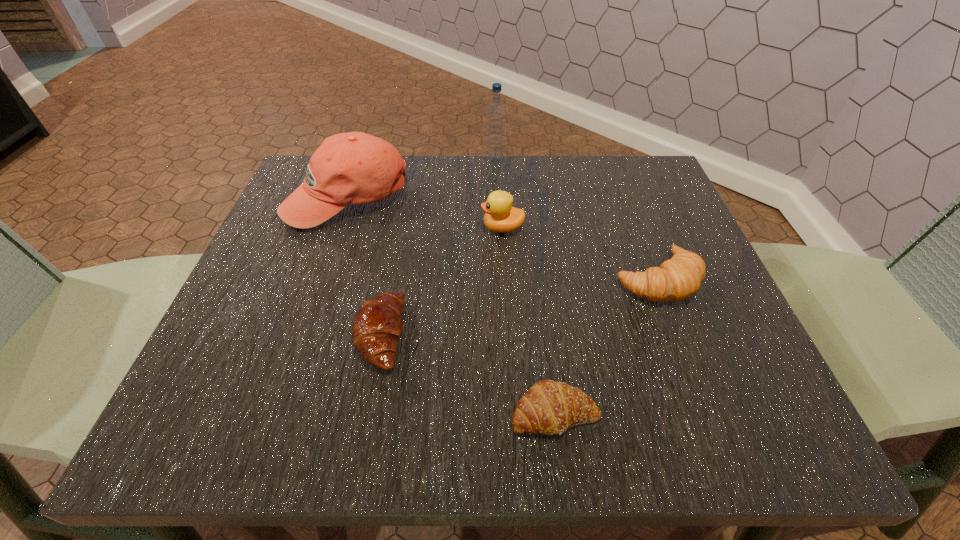
This screenshot has width=960, height=540. What are the coordinates of `object at the left edge` in the screenshot? It's located at (348, 168).

Where is `object at the right edge`? Image resolution: width=960 pixels, height=540 pixels. object at the right edge is located at coordinates (678, 278).

The width and height of the screenshot is (960, 540). Find the location of `object positioned at the far left corner`. object positioned at the far left corner is located at coordinates (348, 168).

Locate an element on the screen. vacant region at the far edge is located at coordinates (588, 211).

At what (x,y) coordinates should I click in order to perform the action: click on vacant point at the left edge. Please return your answer as a coordinate pair (x, y). Looking at the image, I should click on [312, 269].

In the image, there is a desktop. Identify the location of vacant space at the right edge. The image size is (960, 540). (671, 223).

I want to click on vacant space at the far right corner of the desktop, so click(x=636, y=217).

Identify the location of free space between the nearest crescent roll and the duckling. Image resolution: width=960 pixels, height=540 pixels. 529,321.

Find the location of a particular element. unoccupied position between the fourth shortest object and the third shortest object is located at coordinates (580, 253).

At what (x,y) coordinates should I click in order to perform the action: click on vacant space in between the tallest crescent roll and the leftmost crescent roll. Please return your answer as a coordinate pair (x, y). Looking at the image, I should click on (518, 307).